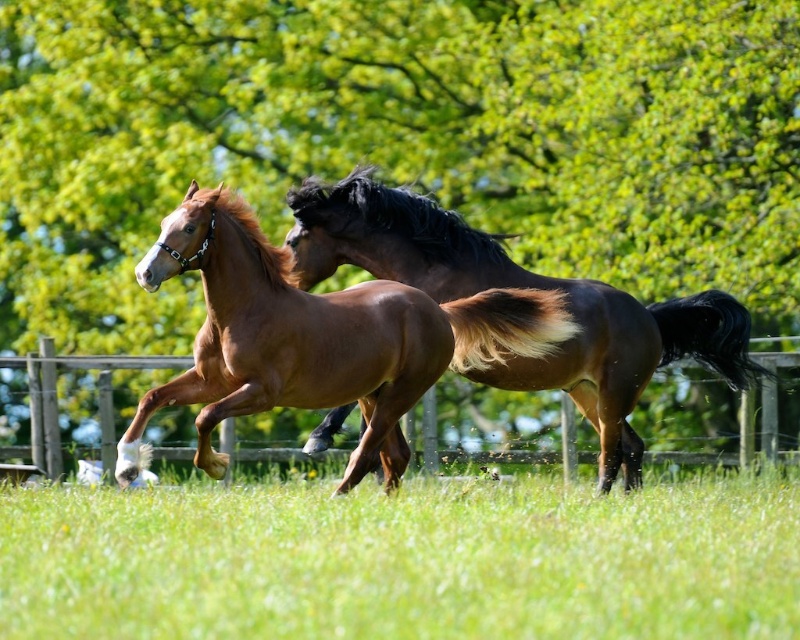
Question: Which of the following is the closest to the observer?

Choices:
 (A) wooden fence at center
 (B) brown glossy horse at center
 (C) green grass at center
 (D) green leafy tree at upper center

Answer: (C)

Question: Among these objects, which one is nearest to the camera?

Choices:
 (A) shiny brown horse at center
 (B) green grass at center
 (C) green leafy tree at upper center
 (D) wooden fence at center

Answer: (B)

Question: Can you confirm if green grass at center is positioned below wooden fence at center?

Choices:
 (A) no
 (B) yes

Answer: (B)

Question: Among these objects, which one is farthest from the camera?

Choices:
 (A) green leafy tree at upper center
 (B) green grass at center

Answer: (A)

Question: Can you confirm if shiny brown horse at center is bigger than wooden fence at center?

Choices:
 (A) yes
 (B) no

Answer: (B)

Question: Does shiny brown horse at center have a lesser width compared to wooden fence at center?

Choices:
 (A) no
 (B) yes

Answer: (B)